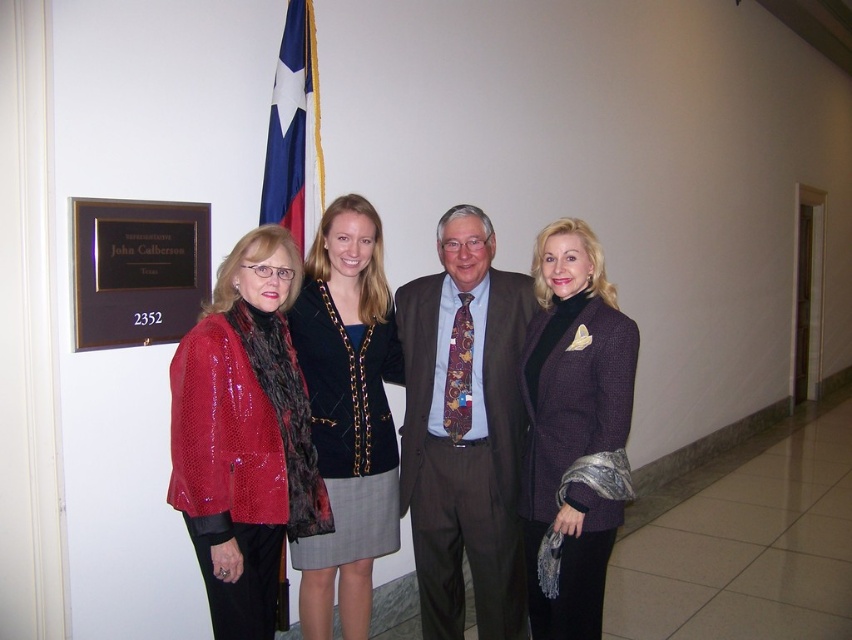
Between purple textured blazer at right and velvet black blazer at center, which one is positioned lower?

purple textured blazer at right

Looking at this image, does purple textured blazer at right appear on the left side of velvet black blazer at center?

No, purple textured blazer at right is not to the left of velvet black blazer at center.

Measure the distance between purple textured blazer at right and camera.

A distance of 7.48 feet exists between purple textured blazer at right and camera.

At what (x,y) coordinates should I click in order to perform the action: click on purple textured blazer at right. Please return your answer as a coordinate pair (x, y). The image size is (852, 640). Looking at the image, I should click on (573, 428).

Is brown textured suit at center above blue fabric flag at upper center?

Incorrect, brown textured suit at center is not positioned above blue fabric flag at upper center.

Can you confirm if brown textured suit at center is smaller than blue fabric flag at upper center?

Actually, brown textured suit at center might be larger than blue fabric flag at upper center.

Where is `brown textured suit at center`? brown textured suit at center is located at coordinates (464, 429).

Does point (511, 632) come in front of point (556, 538)?

No, it is not.

Does brown textured suit at center appear on the left side of purple textured blazer at right?

Indeed, brown textured suit at center is positioned on the left side of purple textured blazer at right.

Between point (461, 464) and point (534, 320), which one is positioned behind?

The point (461, 464) is behind.

The width and height of the screenshot is (852, 640). Identify the location of brown textured suit at center. (464, 429).